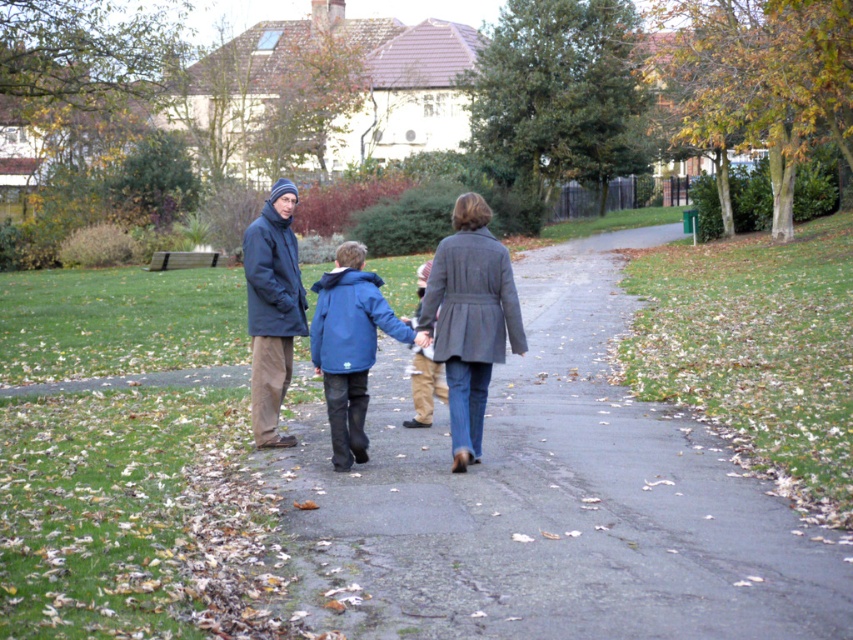
You are standing at point (x=474, y=212) and want to walk to the house in the background. Is the point (x=604, y=369) in front of or behind you along your path?

Point (x=604, y=369) is behind point (x=474, y=212), so it is behind you along your path towards the house.

You are standing at the point marked by coordinates point (552, 499). What type of surface are you currently standing on?

→ The gray asphalt pavement at center is represented by point (552, 499), so you are standing on the gray asphalt pavement at center.

You are a delivery person trying to deliver a package to the house in the background. You need to walk along the path. Which object, the gray asphalt pavement at center or the khaki cotton pants at center, should you step on to reach the house?

You should step on the gray asphalt pavement at center because it is larger in size than the khaki cotton pants at center, making it a more stable and appropriate path to follow towards the house.